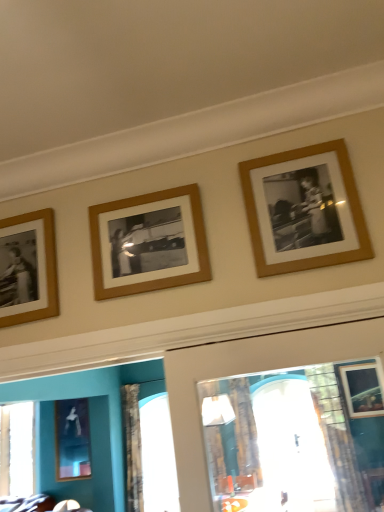
How much space does wooden photo frame at left, acting as the 2th picture frame starting from the left, occupy vertically?

14.24 inches.

This screenshot has height=512, width=384. What do you see at coordinates (46, 268) in the screenshot? I see `wooden photo frame at left, marked as the second picture frame in a bottom-to-top arrangement` at bounding box center [46, 268].

Identify the location of wooden frame at center, placed as the 2th picture frame when sorted from right to left. (149, 243).

What is the approximate height of metallic silver frame at lower left, which ranks as the 1th picture frame in back-to-front order?

It is 3.65 feet.

Find the location of a particular element. This screenshot has width=384, height=512. wooden photo frame at left, marked as the second picture frame in a bottom-to-top arrangement is located at coordinates (46, 268).

Is wooden photo frame at upper right, acting as the 1th picture frame starting from the front, in front of metallic silver frame at lower left, which is the 1th picture frame in left-to-right order?

That is True.

Can you tell me how much wooden photo frame at upper right, marked as the fourth picture frame in a back-to-front arrangement, and metallic silver frame at lower left, the 1th picture frame in the bottom-to-top sequence, differ in facing direction?

2.62 degrees.

Which of these two, wooden photo frame at upper right, acting as the 1th picture frame starting from the front, or metallic silver frame at lower left, placed as the fourth picture frame when sorted from right to left, is smaller?

Smaller between the two is wooden photo frame at upper right, acting as the 1th picture frame starting from the front.

Is wooden photo frame at upper right, acting as the first picture frame starting from the right, looking in the opposite direction of metallic silver frame at lower left, which is the 1th picture frame in left-to-right order?

No, wooden photo frame at upper right, acting as the first picture frame starting from the right,'s orientation is not away from metallic silver frame at lower left, which is the 1th picture frame in left-to-right order.

Are wooden photo frame at upper right, positioned as the 4th picture frame in bottom-to-top order, and wooden photo frame at left, acting as the 2th picture frame starting from the left, far apart?

No, wooden photo frame at upper right, positioned as the 4th picture frame in bottom-to-top order, is not far from wooden photo frame at left, acting as the 2th picture frame starting from the left.

Considering the sizes of objects wooden photo frame at upper right, which ranks as the fourth picture frame in left-to-right order, and wooden photo frame at left, which is counted as the third picture frame, starting from the right, in the image provided, who is wider, wooden photo frame at upper right, which ranks as the fourth picture frame in left-to-right order, or wooden photo frame at left, which is counted as the third picture frame, starting from the right,?

With larger width is wooden photo frame at left, which is counted as the third picture frame, starting from the right.

From the image's perspective, relative to wooden photo frame at left, the 3th picture frame from the top, is wooden photo frame at upper right, acting as the first picture frame starting from the right, above or below?

wooden photo frame at upper right, acting as the first picture frame starting from the right, is situated higher than wooden photo frame at left, the 3th picture frame from the top, in the image.

At what (x,y) coordinates should I click in order to perform the action: click on picture frame behind the wooden photo frame at left, which is the 3th picture frame from front to back. Please return your answer as a coordinate pair (x, y). Looking at the image, I should click on (72, 439).

Does wooden photo frame at left, placed as the second picture frame when sorted from back to front, contain metallic silver frame at lower left, which ranks as the 1th picture frame in back-to-front order?

No, wooden photo frame at left, placed as the second picture frame when sorted from back to front, does not contain metallic silver frame at lower left, which ranks as the 1th picture frame in back-to-front order.

Between wooden photo frame at left, placed as the second picture frame when sorted from back to front, and metallic silver frame at lower left, which ranks as the 1th picture frame in back-to-front order, which one has larger size?

metallic silver frame at lower left, which ranks as the 1th picture frame in back-to-front order.

Is wooden photo frame at left, acting as the 2th picture frame starting from the left, at the right side of metallic silver frame at lower left, placed as the fourth picture frame when sorted from right to left?

Correct, you'll find wooden photo frame at left, acting as the 2th picture frame starting from the left, to the right of metallic silver frame at lower left, placed as the fourth picture frame when sorted from right to left.

Can you confirm if metallic silver frame at lower left, which is the 1th picture frame in left-to-right order, is bigger than wooden frame at center, the third picture frame when ordered from back to front?

Correct, metallic silver frame at lower left, which is the 1th picture frame in left-to-right order, is larger in size than wooden frame at center, the third picture frame when ordered from back to front.

Considering the positions of points (82, 403) and (178, 192), is point (82, 403) farther from camera compared to point (178, 192)?

Yes, it is behind point (178, 192).

Which object is positioned more to the left, metallic silver frame at lower left, acting as the fourth picture frame starting from the front, or wooden frame at center, arranged as the third picture frame when ordered from the bottom?

metallic silver frame at lower left, acting as the fourth picture frame starting from the front.

Can you tell me how much metallic silver frame at lower left, which is the 1th picture frame in left-to-right order, and wooden frame at center, which is the 2th picture frame in front-to-back order, differ in facing direction?

There is a 0.25-degree angle between the facing directions of metallic silver frame at lower left, which is the 1th picture frame in left-to-right order, and wooden frame at center, which is the 2th picture frame in front-to-back order.

From the image's perspective, which one is positioned higher, wooden frame at center, arranged as the third picture frame when ordered from the bottom, or wooden photo frame at upper right, marked as the fourth picture frame in a back-to-front arrangement?

wooden photo frame at upper right, marked as the fourth picture frame in a back-to-front arrangement, appears higher in the image.

From the image's perspective, which picture frame is the 1st one below the wooden photo frame at upper right, acting as the first picture frame starting from the right? Please provide its 2D coordinates.

[(149, 243)]

Between wooden frame at center, the third picture frame when ordered from back to front, and wooden photo frame at upper right, which appears as the 1th picture frame when viewed from the top, which one has more height?

With more height is wooden photo frame at upper right, which appears as the 1th picture frame when viewed from the top.

Which is nearer, [142,234] or [367,257]?

Positioned in front is point [367,257].

In the scene shown: How different are the orientations of wooden photo frame at left, which is counted as the third picture frame, starting from the right, and wooden frame at center, which is the 2th picture frame in front-to-back order, in degrees?

1.51 degrees separate the facing orientations of wooden photo frame at left, which is counted as the third picture frame, starting from the right, and wooden frame at center, which is the 2th picture frame in front-to-back order.

Looking at this image, is wooden photo frame at left, which is the 3th picture frame from front to back, bigger than wooden frame at center, which is the 2th picture frame in front-to-back order?

Indeed, wooden photo frame at left, which is the 3th picture frame from front to back, has a larger size compared to wooden frame at center, which is the 2th picture frame in front-to-back order.

Who is taller, wooden photo frame at left, acting as the 2th picture frame starting from the left, or wooden frame at center, the third picture frame when ordered from left to right?

wooden photo frame at left, acting as the 2th picture frame starting from the left.

Is the position of wooden photo frame at left, which is the 3th picture frame from front to back, less distant than that of wooden frame at center, placed as the 2th picture frame when sorted from top to bottom?

No, it is not.

Relative to wooden photo frame at left, placed as the second picture frame when sorted from back to front, is metallic silver frame at lower left, placed as the fourth picture frame when sorted from right to left, in front or behind?

metallic silver frame at lower left, placed as the fourth picture frame when sorted from right to left, is behind wooden photo frame at left, placed as the second picture frame when sorted from back to front.

Is metallic silver frame at lower left, acting as the fourth picture frame starting from the front, aimed at wooden photo frame at left, which is the 3th picture frame from front to back?

No.

Considering the relative sizes of metallic silver frame at lower left, placed as the fourth picture frame when sorted from right to left, and wooden photo frame at left, the 3th picture frame from the top, in the image provided, is metallic silver frame at lower left, placed as the fourth picture frame when sorted from right to left, smaller than wooden photo frame at left, the 3th picture frame from the top,?

No.

You are a GUI agent. You are given a task and a screenshot of the screen. Output one action in this format:
    pyautogui.click(x=<x>, y=<y>)
    Task: Click on the 3rd picture frame behind the wooden photo frame at upper right, acting as the first picture frame starting from the right, counting from the anchor's position
    The width and height of the screenshot is (384, 512).
    Given the screenshot: What is the action you would take?
    pyautogui.click(x=72, y=439)

What are the coordinates of `picture frame that is the 2nd object to the right of the wooden photo frame at left, which is counted as the third picture frame, starting from the right, starting at the anchor` in the screenshot? It's located at (346, 196).

Which object lies further to the anchor point wooden frame at center, the third picture frame when ordered from back to front, metallic silver frame at lower left, the 1th picture frame in the bottom-to-top sequence, or wooden photo frame at upper right, which ranks as the fourth picture frame in left-to-right order?

metallic silver frame at lower left, the 1th picture frame in the bottom-to-top sequence, lies further to wooden frame at center, the third picture frame when ordered from back to front, than the other object.

Which object lies further to the anchor point wooden photo frame at upper right, acting as the 1th picture frame starting from the front, wooden frame at center, placed as the 2th picture frame when sorted from top to bottom, or wooden photo frame at left, placed as the second picture frame when sorted from back to front?

wooden photo frame at left, placed as the second picture frame when sorted from back to front.

Based on their spatial positions, is wooden photo frame at left, acting as the 2th picture frame starting from the left, or wooden photo frame at upper right, acting as the first picture frame starting from the right, further from metallic silver frame at lower left, which is counted as the fourth picture frame, starting from the top?

Among the two, wooden photo frame at upper right, acting as the first picture frame starting from the right, is located further to metallic silver frame at lower left, which is counted as the fourth picture frame, starting from the top.

Based on their spatial positions, is metallic silver frame at lower left, which ranks as the 1th picture frame in back-to-front order, or wooden photo frame at upper right, which ranks as the fourth picture frame in left-to-right order, further from wooden photo frame at left, which is counted as the third picture frame, starting from the right?

Among the two, metallic silver frame at lower left, which ranks as the 1th picture frame in back-to-front order, is located further to wooden photo frame at left, which is counted as the third picture frame, starting from the right.

Looking at the image, which one is located further to metallic silver frame at lower left, which is counted as the fourth picture frame, starting from the top, wooden photo frame at upper right, which ranks as the fourth picture frame in left-to-right order, or wooden frame at center, placed as the 2th picture frame when sorted from top to bottom?

The object further to metallic silver frame at lower left, which is counted as the fourth picture frame, starting from the top, is wooden photo frame at upper right, which ranks as the fourth picture frame in left-to-right order.

Based on their spatial positions, is metallic silver frame at lower left, the 1th picture frame in the bottom-to-top sequence, or wooden photo frame at left, which is the 3th picture frame from front to back, further from wooden frame at center, arranged as the third picture frame when ordered from the bottom?

Among the two, metallic silver frame at lower left, the 1th picture frame in the bottom-to-top sequence, is located further to wooden frame at center, arranged as the third picture frame when ordered from the bottom.

When comparing their distances from wooden photo frame at upper right, acting as the first picture frame starting from the right, does wooden frame at center, which is the 2th picture frame in front-to-back order, or metallic silver frame at lower left, which is counted as the fourth picture frame, starting from the top, seem further?

metallic silver frame at lower left, which is counted as the fourth picture frame, starting from the top, is further to wooden photo frame at upper right, acting as the first picture frame starting from the right.

Based on their spatial positions, is wooden photo frame at left, placed as the second picture frame when sorted from back to front, or wooden photo frame at upper right, acting as the 1th picture frame starting from the front, further from wooden frame at center, placed as the 2th picture frame when sorted from right to left?

wooden photo frame at upper right, acting as the 1th picture frame starting from the front, lies further to wooden frame at center, placed as the 2th picture frame when sorted from right to left, than the other object.

This screenshot has width=384, height=512. I want to click on picture frame between wooden photo frame at left, which is the 3th picture frame from front to back, and wooden photo frame at upper right, acting as the 1th picture frame starting from the front, in the horizontal direction, so click(149, 243).

Locate an element on the screen. This screenshot has width=384, height=512. picture frame between wooden frame at center, the third picture frame when ordered from left to right, and metallic silver frame at lower left, which is the 1th picture frame in left-to-right order, from front to back is located at coordinates (46, 268).